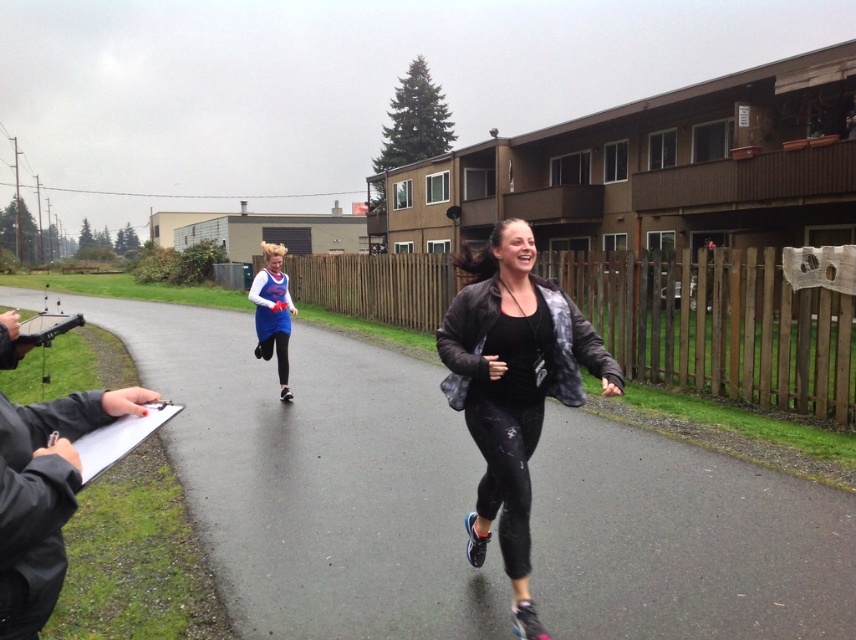
Is the position of black matte jacket at center more distant than that of blue jersey at center?

No, black matte jacket at center is closer to the viewer.

Which is behind, point (464, 292) or point (271, 250)?

The point (271, 250) is behind.

Does point (539, 634) come closer to viewer compared to point (265, 320)?

That is True.

I want to click on black matte jacket at center, so click(513, 387).